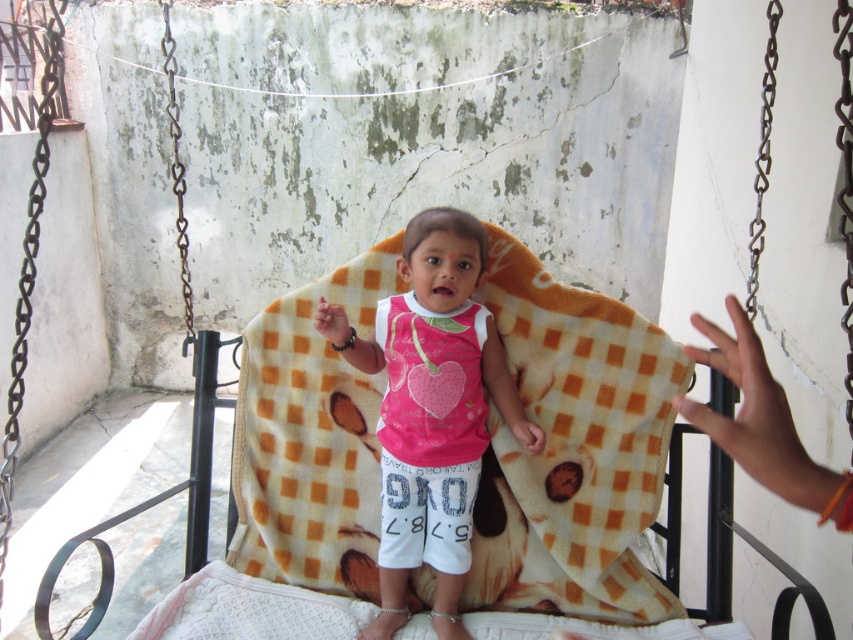
You are a photographer trying to capture the orange checkered blanket at center in the image. What coordinates should you focus on to ensure the blanket is centered in your shot?

The orange checkered blanket at center is located at coordinates point (572, 449), so you should focus your camera there to center it.

You are a photographer trying to capture the child in the scene. Since the orange checkered blanket at center and the pink fleece shirt at center are both in the frame, which one should you focus on if you want to highlight the larger object?

The orange checkered blanket at center is larger than the pink fleece shirt at center, so focusing on the orange checkered blanket at center would highlight the larger object.

You are a photographer trying to capture a closeup of the orange checkered blanket at center and the pink fleece shirt at center. Which object should you focus on first if you want to ensure both are in focus without adjusting the camera settings?

The orange checkered blanket at center is further to the viewer than the pink fleece shirt at center. To keep both in focus, focus on the orange checkered blanket at center first since it is closer, allowing the pink fleece shirt at center in the background to remain sharp with proper depth of field.